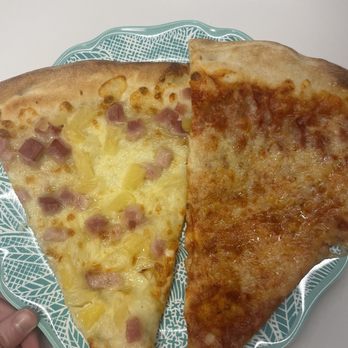
The image size is (348, 348). What are the coordinates of `table above plate` in the screenshot? It's located at (84, 25).